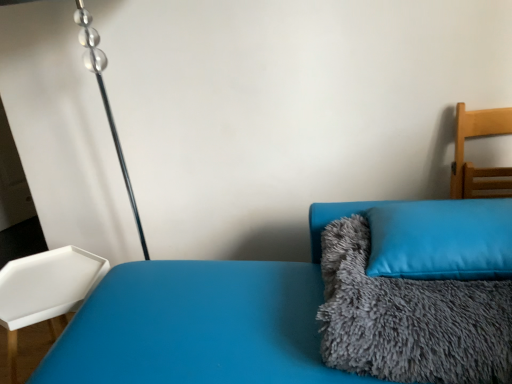
Question: Is gray fluffy blanket at right positioned behind blue soft cushion at right?

Choices:
 (A) yes
 (B) no

Answer: (B)

Question: Is gray fluffy blanket at right next to blue soft cushion at right and touching it?

Choices:
 (A) no
 (B) yes

Answer: (B)

Question: Considering the relative sizes of gray fluffy blanket at right and blue soft cushion at right in the image provided, is gray fluffy blanket at right bigger than blue soft cushion at right?

Choices:
 (A) no
 (B) yes

Answer: (B)

Question: Considering the relative sizes of gray fluffy blanket at right and blue soft cushion at right in the image provided, is gray fluffy blanket at right taller than blue soft cushion at right?

Choices:
 (A) yes
 (B) no

Answer: (A)

Question: Would you say gray fluffy blanket at right is a long distance from blue soft cushion at right?

Choices:
 (A) yes
 (B) no

Answer: (B)

Question: Does gray fluffy blanket at right contain blue soft cushion at right?

Choices:
 (A) no
 (B) yes

Answer: (B)

Question: Is gray fluffy blanket at right turned away from light wood chair at right, placed as the 2th furniture when sorted from bottom to top?

Choices:
 (A) no
 (B) yes

Answer: (A)

Question: Does gray fluffy blanket at right have a smaller size compared to light wood chair at right, placed as the 2th furniture when sorted from bottom to top?

Choices:
 (A) no
 (B) yes

Answer: (A)

Question: Are gray fluffy blanket at right and light wood chair at right, the 1th furniture from the right, far apart?

Choices:
 (A) no
 (B) yes

Answer: (A)

Question: From the image's perspective, is gray fluffy blanket at right above light wood chair at right, the 1th furniture from the right?

Choices:
 (A) yes
 (B) no

Answer: (B)

Question: Can you confirm if gray fluffy blanket at right is shorter than light wood chair at right, arranged as the 1th furniture when viewed from the top?

Choices:
 (A) yes
 (B) no

Answer: (A)

Question: Considering the relative positions of gray fluffy blanket at right and light wood chair at right, placed as the 2th furniture when sorted from bottom to top, in the image provided, is gray fluffy blanket at right to the right of light wood chair at right, placed as the 2th furniture when sorted from bottom to top, from the viewer's perspective?

Choices:
 (A) no
 (B) yes

Answer: (A)

Question: Considering the relative sizes of light wood chair at right, arranged as the 2th furniture when viewed from the left, and white plastic tray at left, arranged as the second furniture when viewed from the top, in the image provided, is light wood chair at right, arranged as the 2th furniture when viewed from the left, shorter than white plastic tray at left, arranged as the second furniture when viewed from the top,?

Choices:
 (A) no
 (B) yes

Answer: (B)